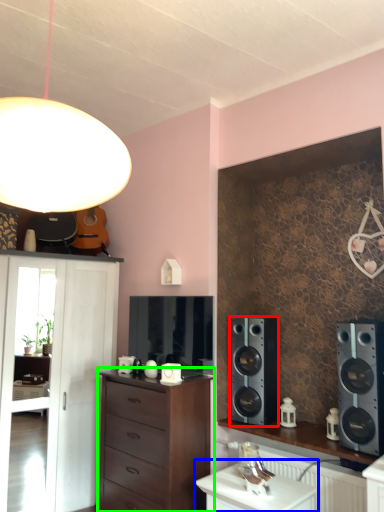
Question: Considering the real-world distances, which object is closest to speaker (highlighted by a red box)? table (highlighted by a blue box) or chest of drawers (highlighted by a green box).

Choices:
 (A) table
 (B) chest of drawers

Answer: (B)